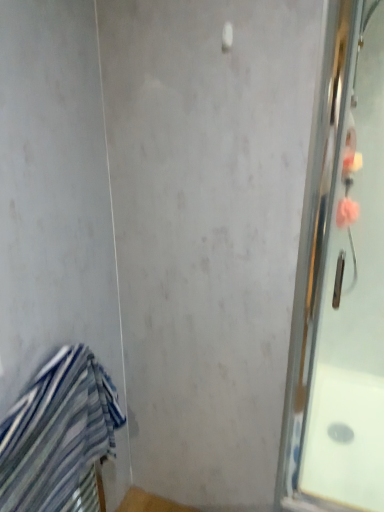
Locate an element on the screen. This screenshot has height=512, width=384. clear glass shower door at right is located at coordinates (340, 283).

The image size is (384, 512). What do you see at coordinates (340, 283) in the screenshot?
I see `clear glass shower door at right` at bounding box center [340, 283].

The width and height of the screenshot is (384, 512). What do you see at coordinates (59, 436) in the screenshot? I see `blue striped towel at lower left` at bounding box center [59, 436].

The width and height of the screenshot is (384, 512). Find the location of `blue striped towel at lower left`. blue striped towel at lower left is located at coordinates (59, 436).

At what (x,y) coordinates should I click in order to perform the action: click on clear glass shower door at right. Please return your answer as a coordinate pair (x, y). Looking at the image, I should click on (340, 283).

Considering the relative positions of clear glass shower door at right and blue striped towel at lower left in the image provided, is clear glass shower door at right to the left or to the right of blue striped towel at lower left?

clear glass shower door at right is positioned on blue striped towel at lower left's right side.

Looking at this image, considering the relative positions of clear glass shower door at right and blue striped towel at lower left in the image provided, is clear glass shower door at right behind blue striped towel at lower left?

Yes, clear glass shower door at right is further from the camera.

Is point (374, 163) farther from viewer compared to point (33, 454)?

Yes, point (374, 163) is behind point (33, 454).

From the image's perspective, is clear glass shower door at right located above or below blue striped towel at lower left?

Clearly, from the image's perspective, clear glass shower door at right is above blue striped towel at lower left.

From a real-world perspective, is clear glass shower door at right physically located above or below blue striped towel at lower left?

clear glass shower door at right is above blue striped towel at lower left.

Considering the sizes of objects clear glass shower door at right and blue striped towel at lower left in the image provided, who is wider, clear glass shower door at right or blue striped towel at lower left?

With larger width is blue striped towel at lower left.

Does clear glass shower door at right have a lesser height compared to blue striped towel at lower left?

In fact, clear glass shower door at right may be taller than blue striped towel at lower left.

Between clear glass shower door at right and blue striped towel at lower left, which one has smaller size?

clear glass shower door at right is smaller.

Could blue striped towel at lower left be considered to be inside clear glass shower door at right?

That's incorrect, blue striped towel at lower left is not inside clear glass shower door at right.

Is clear glass shower door at right positioned far away from blue striped towel at lower left?

No, clear glass shower door at right is not far from blue striped towel at lower left.

Could you tell me if clear glass shower door at right is turned towards blue striped towel at lower left?

No.

How far apart are clear glass shower door at right and blue striped towel at lower left?

They are 27.88 inches apart.

Find the location of a particular element. Image resolution: width=384 pixels, height=512 pixels. towel below the clear glass shower door at right (from the image's perspective) is located at coordinates (59, 436).

Is blue striped towel at lower left at the left side of clear glass shower door at right?

Correct, you'll find blue striped towel at lower left to the left of clear glass shower door at right.

Is blue striped towel at lower left in front of or behind clear glass shower door at right in the image?

blue striped towel at lower left is positioned closer to the viewer than clear glass shower door at right.

Which point is more forward, (18,501) or (318,200)?

Point (18,501)

From the image's perspective, between blue striped towel at lower left and clear glass shower door at right, who is located below?

blue striped towel at lower left, from the image's perspective.

From a real-world perspective, is blue striped towel at lower left positioned under clear glass shower door at right based on gravity?

Yes, from a real-world perspective, blue striped towel at lower left is below clear glass shower door at right.

Which object is wider, blue striped towel at lower left or clear glass shower door at right?

With larger width is blue striped towel at lower left.

Who is shorter, blue striped towel at lower left or clear glass shower door at right?

blue striped towel at lower left.

Is blue striped towel at lower left bigger than clear glass shower door at right?

Correct, blue striped towel at lower left is larger in size than clear glass shower door at right.

Is clear glass shower door at right located within blue striped towel at lower left?

No, clear glass shower door at right is not surrounded by blue striped towel at lower left.

Is blue striped towel at lower left positioned far away from clear glass shower door at right?

No, there isn't a large distance between blue striped towel at lower left and clear glass shower door at right.

Is blue striped towel at lower left facing away from clear glass shower door at right?

No, blue striped towel at lower left is not facing the opposite direction of clear glass shower door at right.

Can you tell me how much blue striped towel at lower left and clear glass shower door at right differ in facing direction?

They differ by 93.3 degrees in their facing directions.

The image size is (384, 512). What are the coordinates of `towel to the left of clear glass shower door at right` in the screenshot? It's located at (59, 436).

Identify the location of screen door located above the blue striped towel at lower left (from a real-world perspective). (340, 283).

Locate an element on the screen. The width and height of the screenshot is (384, 512). towel in front of the clear glass shower door at right is located at coordinates click(x=59, y=436).